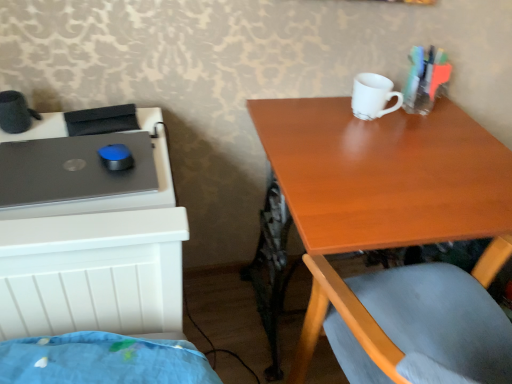
Question: Is matte black laptop at left positioned with its back to white matte mug at upper center?

Choices:
 (A) yes
 (B) no

Answer: (B)

Question: Does matte black laptop at left appear on the left side of white matte mug at upper center?

Choices:
 (A) no
 (B) yes

Answer: (B)

Question: Considering the relative sizes of matte black laptop at left and white matte mug at upper center in the image provided, is matte black laptop at left shorter than white matte mug at upper center?

Choices:
 (A) no
 (B) yes

Answer: (B)

Question: Would you say matte black laptop at left is outside white matte mug at upper center?

Choices:
 (A) no
 (B) yes

Answer: (B)

Question: Is matte black laptop at left next to white matte mug at upper center and touching it?

Choices:
 (A) no
 (B) yes

Answer: (A)

Question: Based on their sizes in the image, would you say matte black laptop at left is bigger or smaller than white matte mug at upper center?

Choices:
 (A) big
 (B) small

Answer: (B)

Question: From the image's perspective, is matte black laptop at left located above or below white matte mug at upper center?

Choices:
 (A) above
 (B) below

Answer: (B)

Question: Is point (12, 178) closer or farther from the camera than point (368, 107)?

Choices:
 (A) closer
 (B) farther

Answer: (A)

Question: Visually, is matte black laptop at left positioned to the left or to the right of white matte mug at upper center?

Choices:
 (A) right
 (B) left

Answer: (B)

Question: Considering the positions of point (49, 165) and point (421, 107), is point (49, 165) closer or farther from the camera than point (421, 107)?

Choices:
 (A) closer
 (B) farther

Answer: (A)

Question: Is matte black laptop at left bigger or smaller than translucent plastic markers at upper right?

Choices:
 (A) big
 (B) small

Answer: (B)

Question: Visually, is matte black laptop at left positioned to the left or to the right of translucent plastic markers at upper right?

Choices:
 (A) left
 (B) right

Answer: (A)

Question: Considering the positions of matte black laptop at left and translucent plastic markers at upper right in the image, is matte black laptop at left wider or thinner than translucent plastic markers at upper right?

Choices:
 (A) thin
 (B) wide

Answer: (B)

Question: Which is correct: white matte mug at upper center is inside translucent plastic markers at upper right, or outside of it?

Choices:
 (A) outside
 (B) inside

Answer: (A)

Question: From the image's perspective, is white matte mug at upper center above or below translucent plastic markers at upper right?

Choices:
 (A) below
 (B) above

Answer: (A)